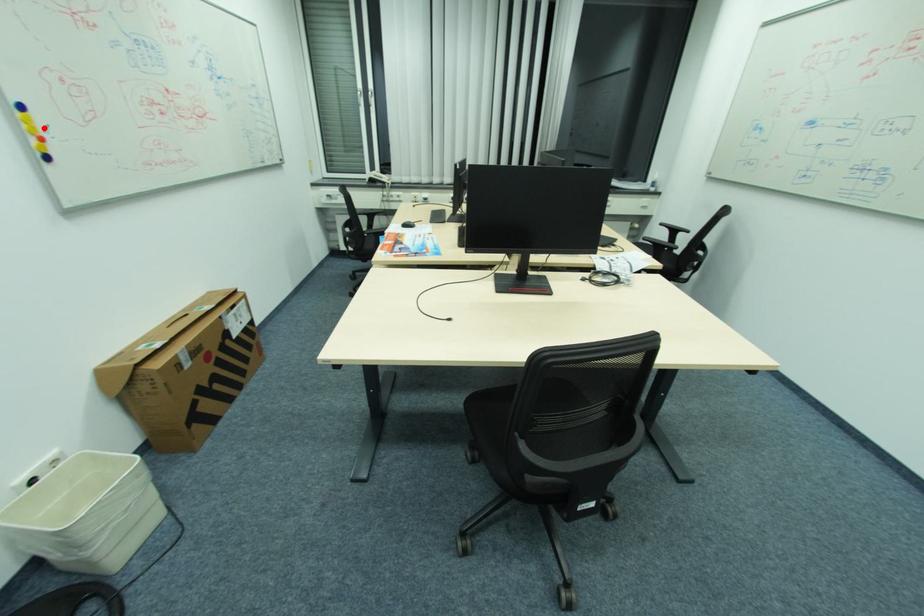
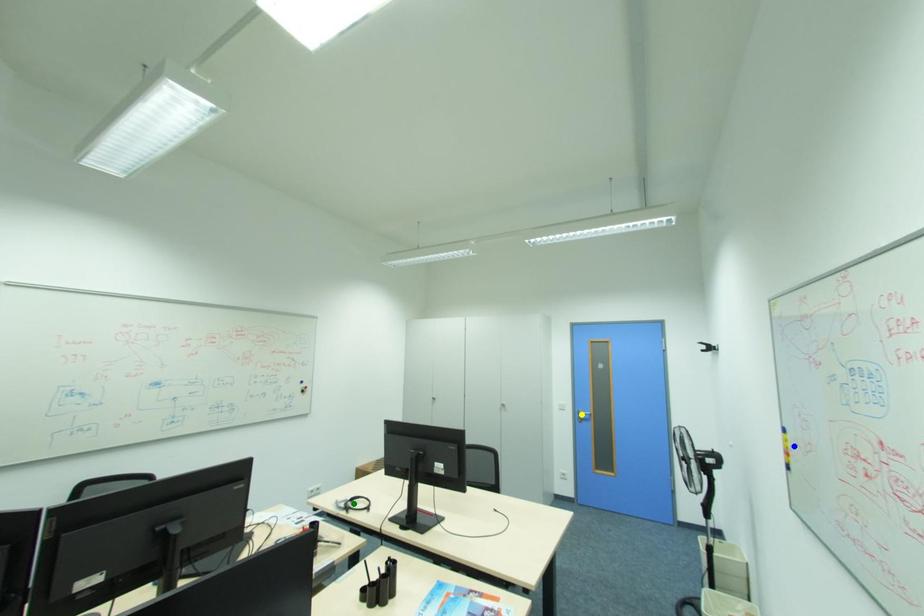
Question: I am providing you with two images of the same scene from different viewpoints. A red point is marked on the first image. You are given multiple points on the second image. Which point in image 2 represents the same 3d spot as the red point in image 1?

Choices:
 (A) blue point
 (B) green point
 (C) yellow point

Answer: (A)